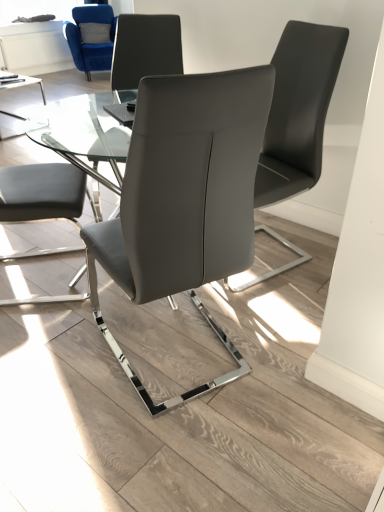
Question: Does transparent glass table at center appear on the left side of matte gray chair at center, the 2th chair in the bottom-to-top sequence?

Choices:
 (A) yes
 (B) no

Answer: (A)

Question: Considering the relative sizes of transparent glass table at center and matte gray chair at center, the 2th chair in the bottom-to-top sequence, in the image provided, is transparent glass table at center thinner than matte gray chair at center, the 2th chair in the bottom-to-top sequence,?

Choices:
 (A) no
 (B) yes

Answer: (A)

Question: From a real-world perspective, is transparent glass table at center physically above matte gray chair at center, acting as the 3th chair starting from the top?

Choices:
 (A) yes
 (B) no

Answer: (B)

Question: Does transparent glass table at center come behind matte gray chair at center, the 2th chair in the bottom-to-top sequence?

Choices:
 (A) yes
 (B) no

Answer: (B)

Question: Considering the relative sizes of transparent glass table at center and matte gray chair at center, the 2th chair in the bottom-to-top sequence, in the image provided, is transparent glass table at center smaller than matte gray chair at center, the 2th chair in the bottom-to-top sequence,?

Choices:
 (A) no
 (B) yes

Answer: (A)

Question: Is matte gray chair at center, marked as the 2th chair in a back-to-front arrangement, inside the boundaries of transparent glass window screen at upper left, or outside?

Choices:
 (A) inside
 (B) outside

Answer: (B)

Question: In terms of size, does matte gray chair at center, which is the third chair from right to left, appear bigger or smaller than transparent glass window screen at upper left?

Choices:
 (A) big
 (B) small

Answer: (A)

Question: In terms of height, does matte gray chair at center, the second chair from the top, look taller or shorter compared to transparent glass window screen at upper left?

Choices:
 (A) tall
 (B) short

Answer: (A)

Question: From a real-world perspective, is matte gray chair at center, the second chair from the left, physically located above or below transparent glass window screen at upper left?

Choices:
 (A) above
 (B) below

Answer: (B)

Question: Is velvet blue armchair at upper left, marked as the fourth chair in a bottom-to-top arrangement, taller or shorter than matte gray chair at center, the second chair when ordered from front to back?

Choices:
 (A) short
 (B) tall

Answer: (A)

Question: Is velvet blue armchair at upper left, which appears as the first chair when viewed from the back, in front of or behind matte gray chair at center, the 2th chair in the bottom-to-top sequence, in the image?

Choices:
 (A) front
 (B) behind

Answer: (B)

Question: From the image's perspective, relative to matte gray chair at center, the second chair when ordered from front to back, is velvet blue armchair at upper left, the 4th chair viewed from the right, above or below?

Choices:
 (A) below
 (B) above

Answer: (B)

Question: Looking at their shapes, would you say velvet blue armchair at upper left, marked as the fourth chair in a bottom-to-top arrangement, is wider or thinner than matte gray chair at center, the second chair when ordered from front to back?

Choices:
 (A) thin
 (B) wide

Answer: (B)

Question: In the image, is matte gray chair at center, the second chair when ordered from front to back, positioned in front of or behind transparent glass table at center?

Choices:
 (A) behind
 (B) front

Answer: (A)

Question: Considering the positions of matte gray chair at center, the first chair when ordered from right to left, and transparent glass table at center in the image, is matte gray chair at center, the first chair when ordered from right to left, wider or thinner than transparent glass table at center?

Choices:
 (A) wide
 (B) thin

Answer: (B)